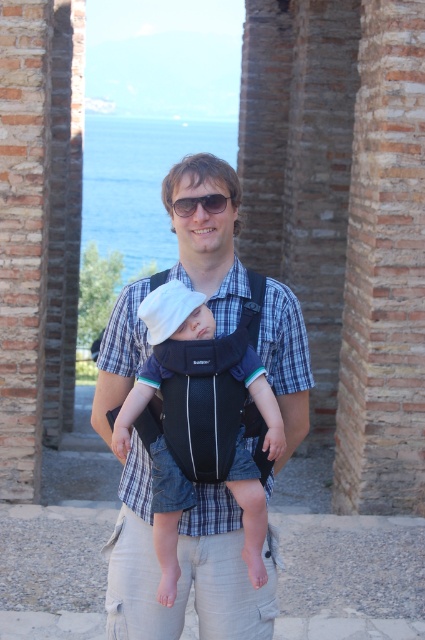
Which is behind, point (212, 484) or point (223, 202)?

The point (223, 202) is behind.

Consider the image. Who is higher up, matte black baby carrier at center or black plastic sunglasses at center?

black plastic sunglasses at center

Locate an element on the screen. The image size is (425, 640). matte black baby carrier at center is located at coordinates (184, 564).